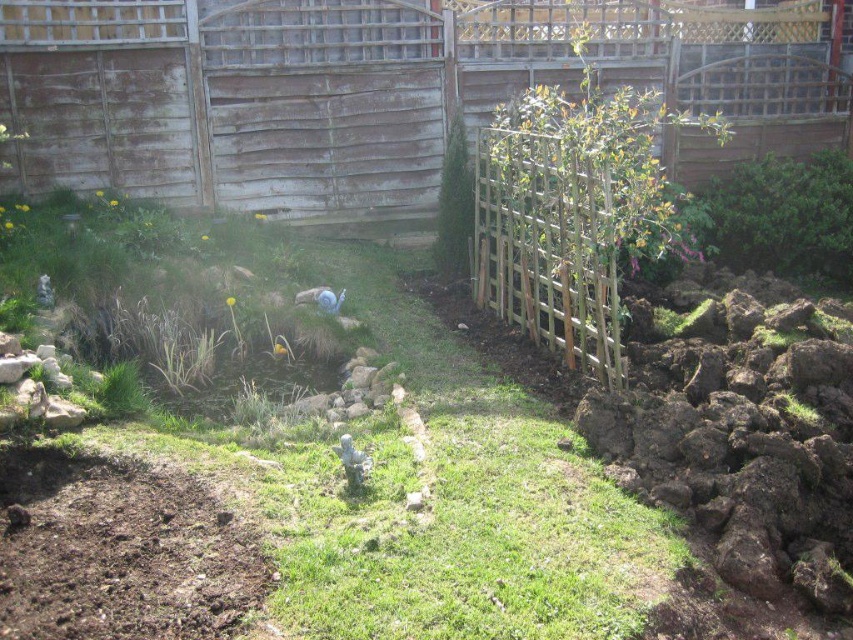
Question: Is green grass at center to the left of weathered wood fence at upper center from the viewer's perspective?

Choices:
 (A) yes
 (B) no

Answer: (A)

Question: Is green grass at center to the right of weathered wood fence at upper center from the viewer's perspective?

Choices:
 (A) yes
 (B) no

Answer: (B)

Question: Does green grass at center appear under weathered wood fence at upper center?

Choices:
 (A) no
 (B) yes

Answer: (B)